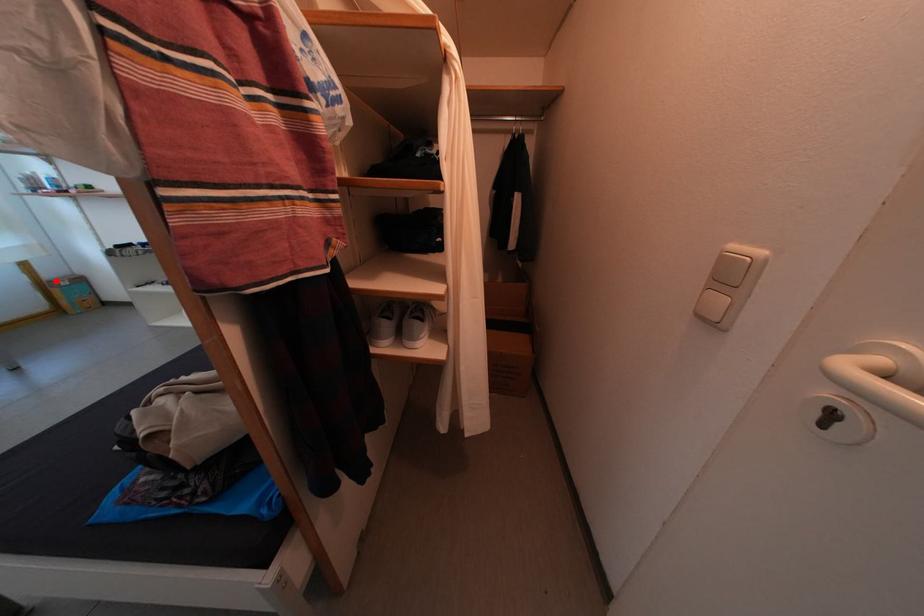
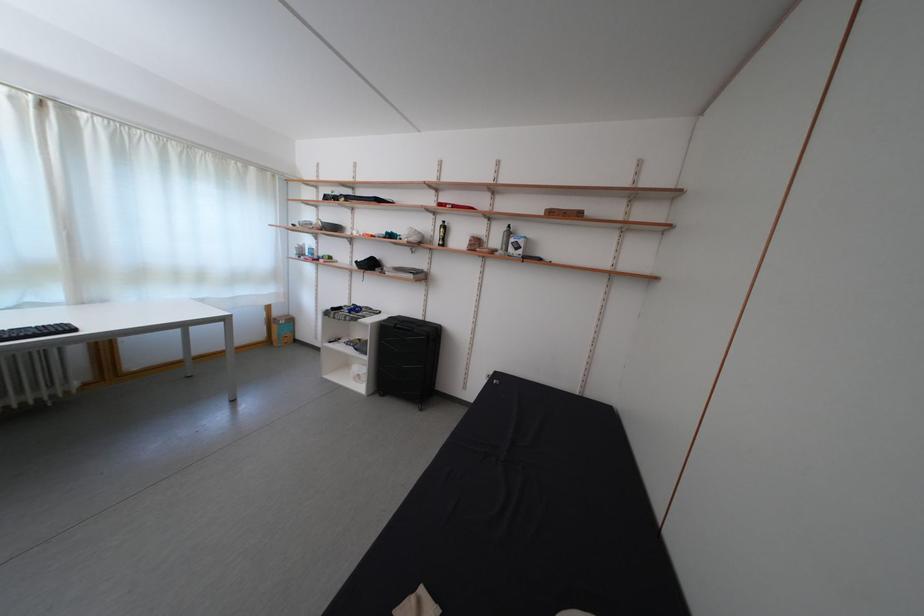
Locate, in the second image, the point that corresponds to the highlighted location in the first image.

(285, 320)